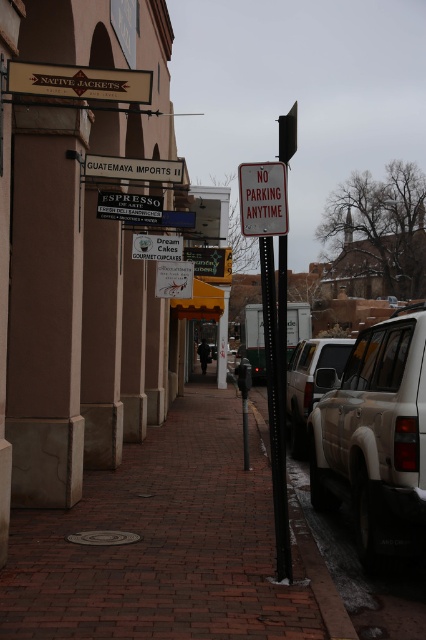
Question: Can you confirm if black metal pole at lower center is bigger than metallic rectangular sign at center?

Choices:
 (A) yes
 (B) no

Answer: (B)

Question: Is metallic rectangular sign at center below white plastic sign at center?

Choices:
 (A) no
 (B) yes

Answer: (A)

Question: Which point is closer to the camera taking this photo?

Choices:
 (A) (255, 480)
 (B) (268, 188)
 (C) (308, 563)
 (D) (299, 445)

Answer: (B)

Question: Which object is closer to the camera taking this photo?

Choices:
 (A) tan matte suv at right
 (B) matte white suv at center
 (C) metallic sign at center

Answer: (B)

Question: Which of the following is the closest to the observer?

Choices:
 (A) tan matte suv at right
 (B) metallic sign at center
 (C) white plastic sign at center
 (D) matte white suv at center

Answer: (C)

Question: Is tan matte suv at right above matte white suv at center?

Choices:
 (A) no
 (B) yes

Answer: (B)